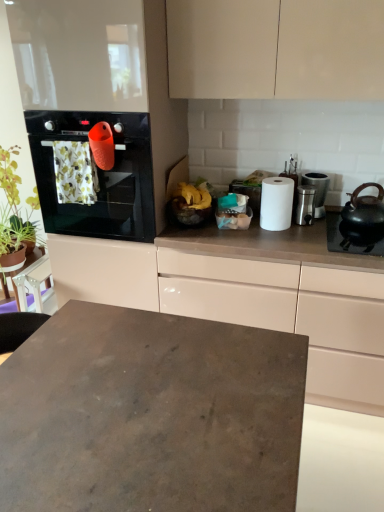
Identify the location of vacant space situated above matte concrete desk at center (from a real-world perspective). The width and height of the screenshot is (384, 512). (146, 402).